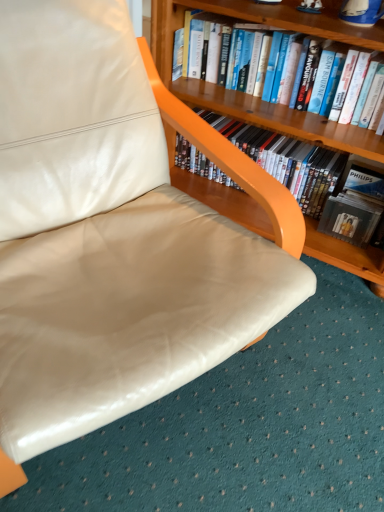
Question: Does hardcover book at upper center, the second book in the bottom-to-top sequence, lie in front of matte black dvd case at upper right, which is the first book from bottom to top?

Choices:
 (A) yes
 (B) no

Answer: (A)

Question: Considering the relative sizes of hardcover book at upper center, the second book in the bottom-to-top sequence, and matte black dvd case at upper right, marked as the second book in a top-to-bottom arrangement, in the image provided, is hardcover book at upper center, the second book in the bottom-to-top sequence, wider than matte black dvd case at upper right, marked as the second book in a top-to-bottom arrangement,?

Choices:
 (A) no
 (B) yes

Answer: (A)

Question: Can you confirm if hardcover book at upper center, the first book when ordered from top to bottom, is thinner than matte black dvd case at upper right, marked as the second book in a top-to-bottom arrangement?

Choices:
 (A) yes
 (B) no

Answer: (A)

Question: From the image's perspective, is hardcover book at upper center, the first book when ordered from top to bottom, under matte black dvd case at upper right, which is the first book from bottom to top?

Choices:
 (A) yes
 (B) no

Answer: (B)

Question: Is hardcover book at upper center, the first book when ordered from top to bottom, oriented away from matte black dvd case at upper right, marked as the second book in a top-to-bottom arrangement?

Choices:
 (A) yes
 (B) no

Answer: (B)

Question: In the image, is wooden bookcase at upper right positioned in front of or behind matte black dvd case at upper right, marked as the second book in a top-to-bottom arrangement?

Choices:
 (A) front
 (B) behind

Answer: (A)

Question: Visually, is wooden bookcase at upper right positioned to the left or to the right of matte black dvd case at upper right, marked as the second book in a top-to-bottom arrangement?

Choices:
 (A) left
 (B) right

Answer: (A)

Question: From a real-world perspective, is wooden bookcase at upper right above or below matte black dvd case at upper right, which is the first book from bottom to top?

Choices:
 (A) above
 (B) below

Answer: (A)

Question: From their relative heights in the image, would you say wooden bookcase at upper right is taller or shorter than matte black dvd case at upper right, which is the first book from bottom to top?

Choices:
 (A) short
 (B) tall

Answer: (B)

Question: From the image's perspective, relative to hardcover book at upper center, the first book when ordered from top to bottom, is matte black dvd case at upper right, which is the first book from bottom to top, above or below?

Choices:
 (A) above
 (B) below

Answer: (B)

Question: Considering the positions of matte black dvd case at upper right, marked as the second book in a top-to-bottom arrangement, and hardcover book at upper center, the first book when ordered from top to bottom, in the image, is matte black dvd case at upper right, marked as the second book in a top-to-bottom arrangement, taller or shorter than hardcover book at upper center, the first book when ordered from top to bottom,?

Choices:
 (A) tall
 (B) short

Answer: (A)

Question: Is matte black dvd case at upper right, which is the first book from bottom to top, in front of or behind hardcover book at upper center, the first book when ordered from top to bottom, in the image?

Choices:
 (A) front
 (B) behind

Answer: (B)

Question: Considering the positions of point (334, 188) and point (198, 36), is point (334, 188) closer or farther from the camera than point (198, 36)?

Choices:
 (A) farther
 (B) closer

Answer: (A)

Question: Considering the relative positions of hardcover book at upper center, the second book in the bottom-to-top sequence, and wooden bookcase at upper right in the image provided, is hardcover book at upper center, the second book in the bottom-to-top sequence, to the left or to the right of wooden bookcase at upper right?

Choices:
 (A) right
 (B) left

Answer: (B)

Question: Considering the positions of hardcover book at upper center, the second book in the bottom-to-top sequence, and wooden bookcase at upper right in the image, is hardcover book at upper center, the second book in the bottom-to-top sequence, bigger or smaller than wooden bookcase at upper right?

Choices:
 (A) small
 (B) big

Answer: (A)